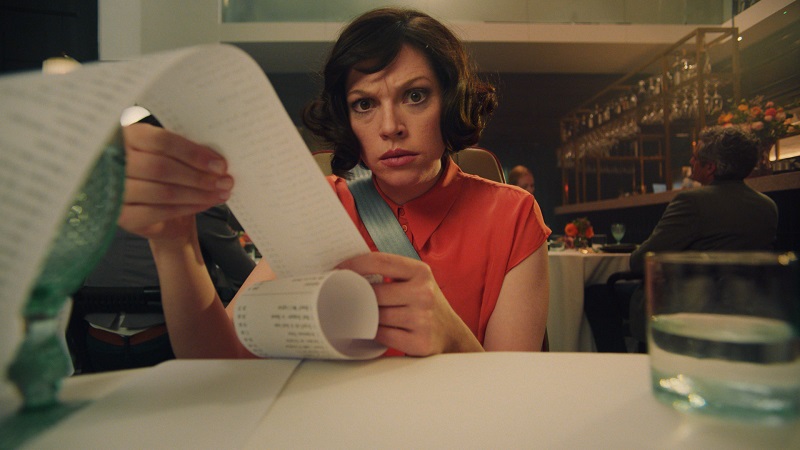
Identify the location of table. (490, 403).